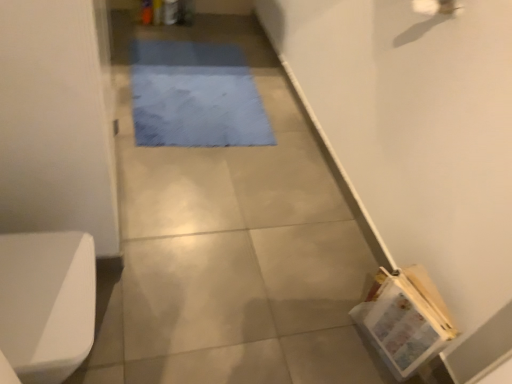
Locate an element on the screen. The height and width of the screenshot is (384, 512). free space above blue fabric mat at center (from a real-world perspective) is located at coordinates (204, 99).